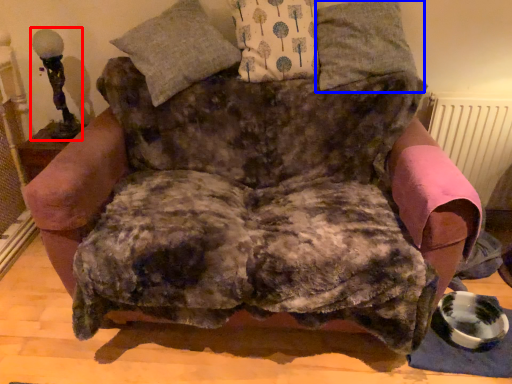
Question: Which point is closer to the camera, table lamp (highlighted by a red box) or pillow (highlighted by a blue box)?

Choices:
 (A) table lamp
 (B) pillow

Answer: (B)